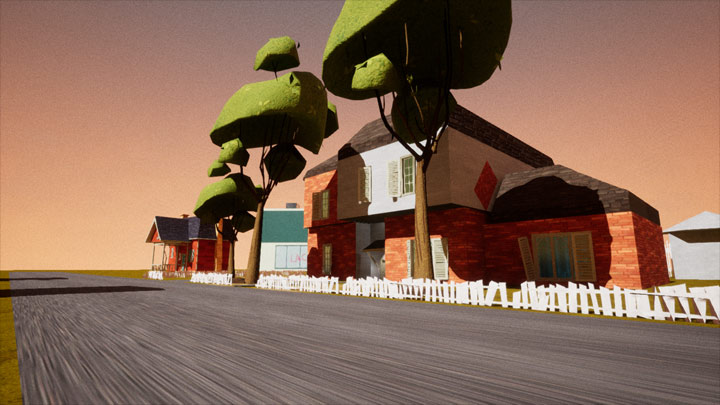
The width and height of the screenshot is (720, 405). In order to click on window in this screenshot , I will do `click(410, 172)`, `click(558, 246)`, `click(360, 180)`.